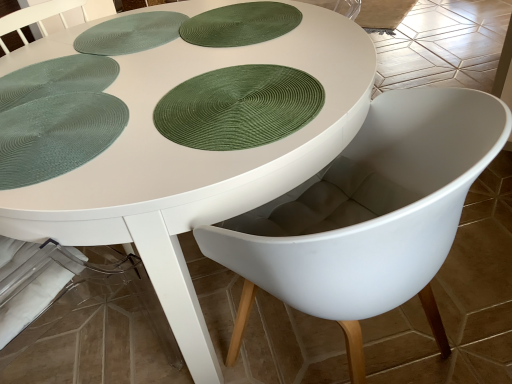
The width and height of the screenshot is (512, 384). Identify the location of vacant space that is in between green textured placemat at upper center, the 1th paper plate viewed from the top, and green textured placemat at upper left, which appears as the 3th paper plate when ordered from the bottom. (140, 58).